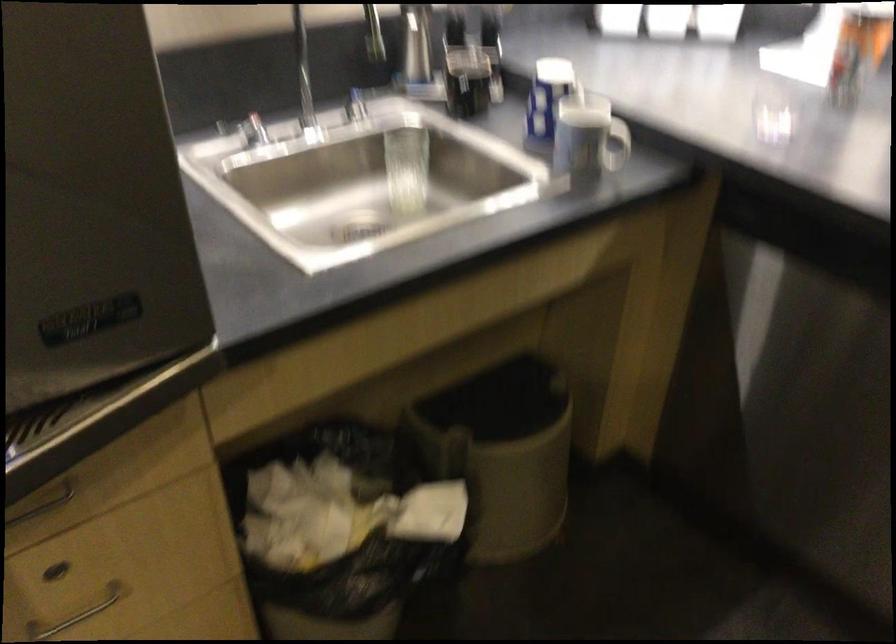
Describe the element at coordinates (303, 69) in the screenshot. I see `a faucet spout` at that location.